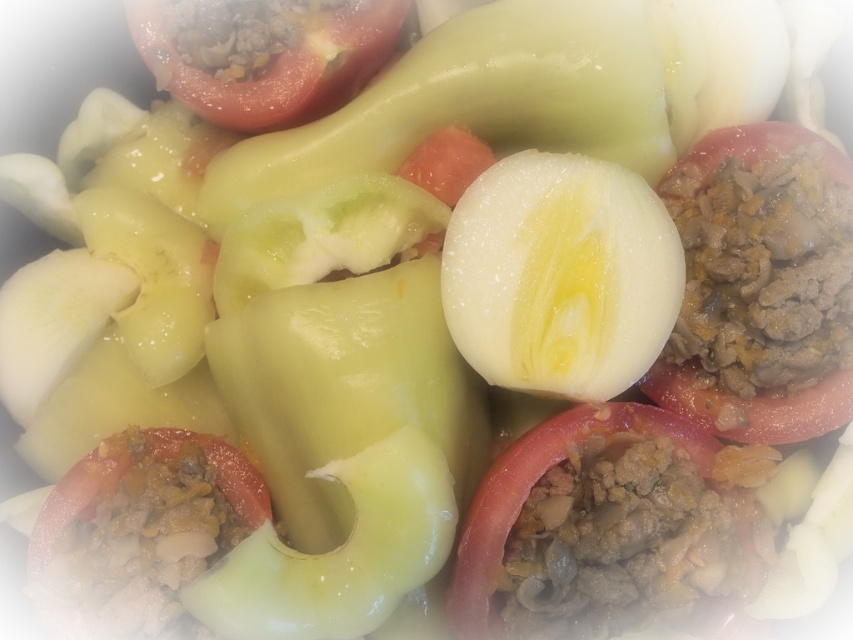
Which is more to the left, brown crumbly meat at center or tomato with ground meat filling at center?

tomato with ground meat filling at center

Between brown crumbly meat at center and tomato with ground meat filling at center, which one appears on the right side from the viewer's perspective?

From the viewer's perspective, brown crumbly meat at center appears more on the right side.

You are a GUI agent. You are given a task and a screenshot of the screen. Output one action in this format:
    pyautogui.click(x=<x>, y=<y>)
    Task: Click on the brown crumbly meat at center
    
    Given the screenshot: What is the action you would take?
    pyautogui.click(x=759, y=285)

What are the coordinates of `brown crumbly meat at center` in the screenshot? It's located at (759, 285).

Can you confirm if brown crumbly meat at center is bigger than white smooth egg at center?

Correct, brown crumbly meat at center is larger in size than white smooth egg at center.

Can you confirm if brown crumbly meat at center is positioned above white smooth egg at center?

Yes, brown crumbly meat at center is above white smooth egg at center.

Which is behind, point (810, 192) or point (584, 300)?

Positioned behind is point (810, 192).

Identify the location of brown crumbly meat at center. (759, 285).

Is point (482, 234) more distant than point (344, 86)?

No, it is not.

Between point (485, 180) and point (183, 76), which one is positioned behind?

Point (183, 76)

In order to click on white smooth egg at center in this screenshot , I will do `click(560, 275)`.